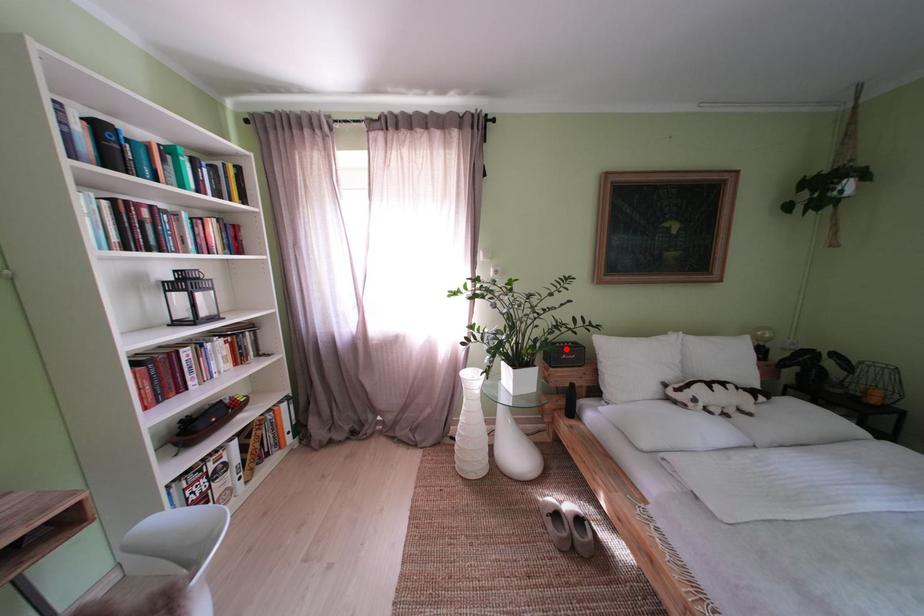
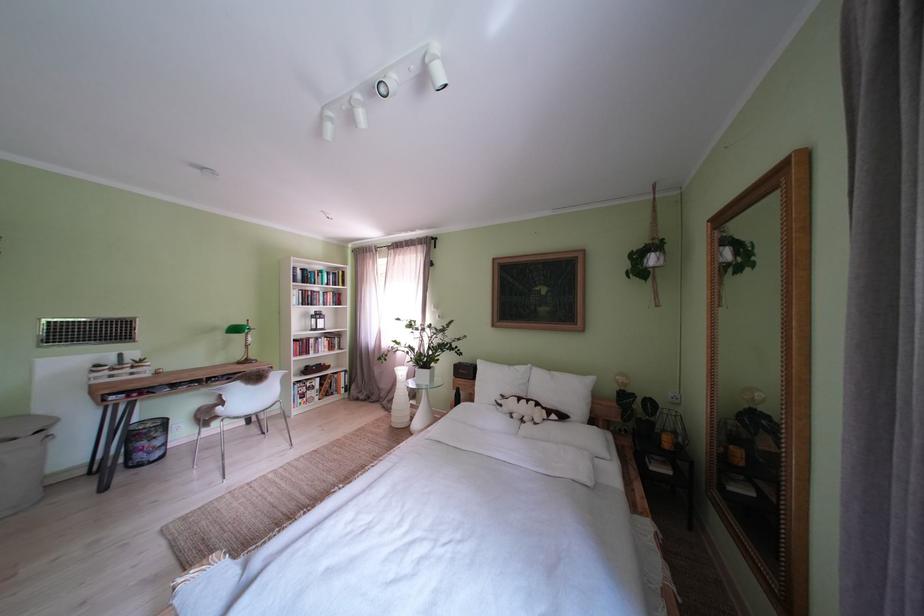
Find the pixel in the second image that matches the highlighted location in the first image.

(472, 369)